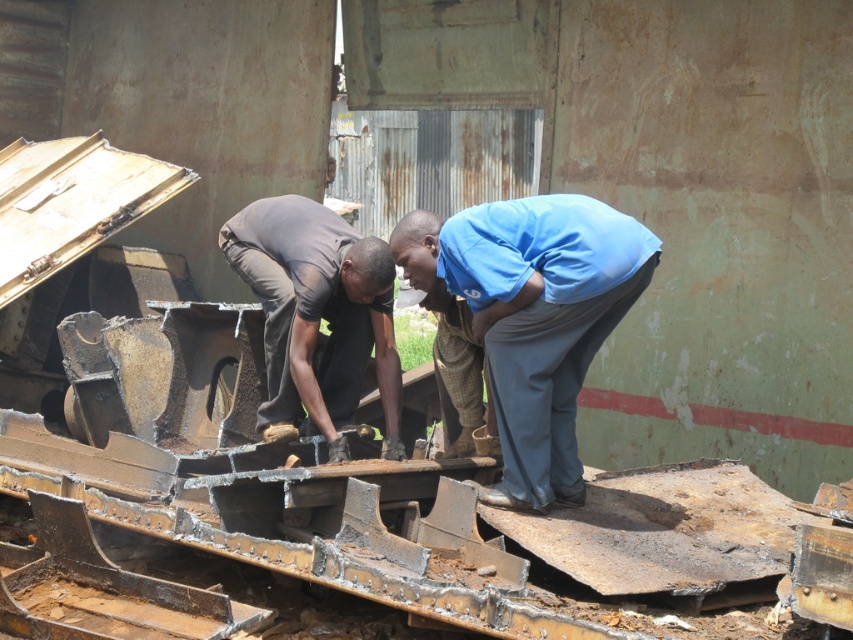
Is blue fabric shirt at center above dark brown fabric shirt at center?

No, blue fabric shirt at center is not above dark brown fabric shirt at center.

Is point (577, 458) more distant than point (242, 257)?

No.

At what (x,y) coordinates should I click in order to perform the action: click on blue fabric shirt at center. Please return your answer as a coordinate pair (x, y). Looking at the image, I should click on (532, 316).